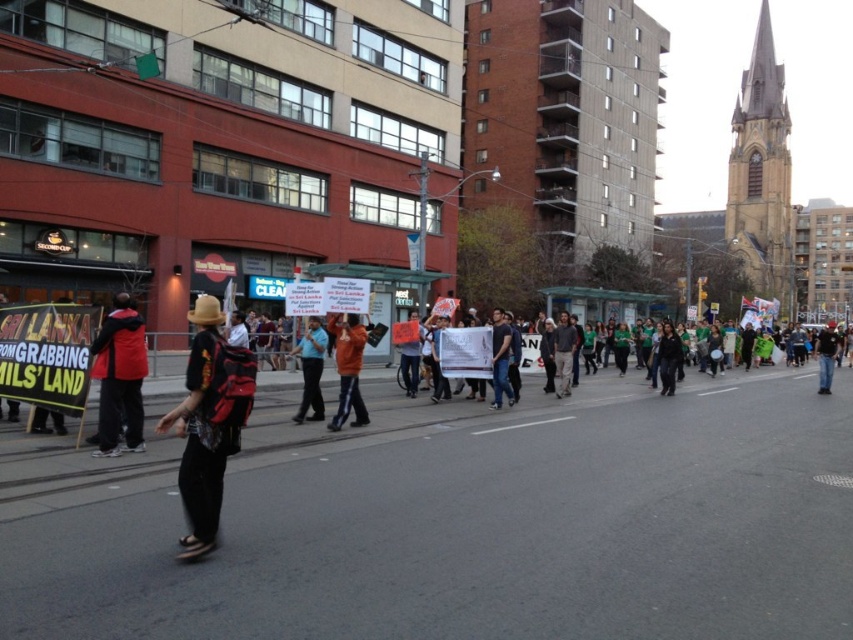
Who is more forward, [564,349] or [415,339]?

Point [415,339]

Is point (573, 332) closer to camera compared to point (412, 362)?

That is False.

You are a GUI agent. You are given a task and a screenshot of the screen. Output one action in this format:
    pyautogui.click(x=<x>, y=<y>)
    Task: Click on the dark gray jacket at center
    This screenshot has height=640, width=853.
    Given the screenshot: What is the action you would take?
    pyautogui.click(x=563, y=353)

Describe the element at coordinates (119, 376) in the screenshot. I see `matte red jacket at left` at that location.

Between matte red jacket at left and dark gray hoodie at center, which one is positioned lower?

dark gray hoodie at center is below.

Who is more forward, (115, 385) or (665, 380)?

Positioned in front is point (115, 385).

I want to click on matte red jacket at left, so click(119, 376).

Between matte red jacket at left and blue shirt at center, which one appears on the left side from the viewer's perspective?

From the viewer's perspective, matte red jacket at left appears more on the left side.

Is matte red jacket at left taller than blue shirt at center?

Yes, matte red jacket at left is taller than blue shirt at center.

Find the location of a particular element. matte red jacket at left is located at coordinates (119, 376).